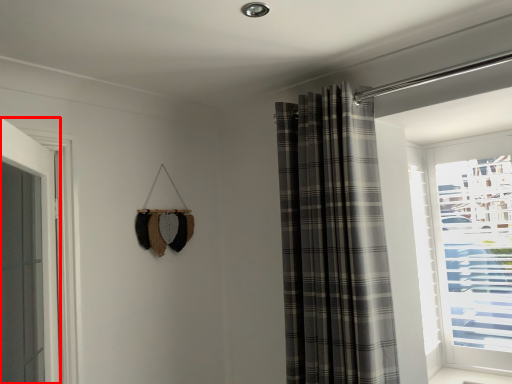
Question: From the image's perspective, what is the correct spatial positioning of door (annotated by the red box) in reference to curtain?

Choices:
 (A) above
 (B) below

Answer: (B)